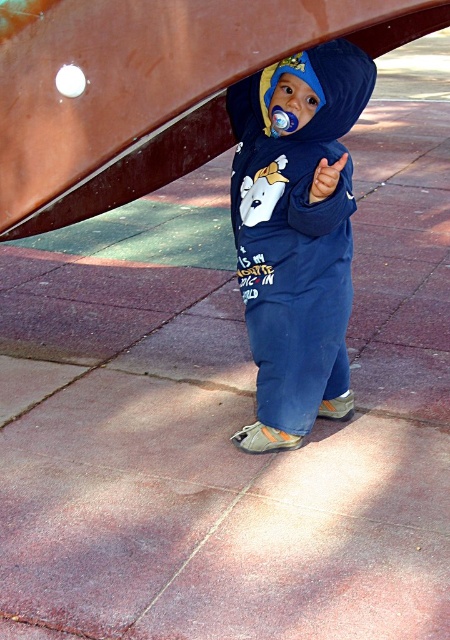
You are a photographer setting up a shot of the child in the scene. You need to ensure that the navy blue fleece onesie at center and the rubber teething ring at center are both clearly visible in the frame. Based on their sizes, which object should you focus on to ensure both are in focus?

The navy blue fleece onesie at center is wider than the rubber teething ring at center, so focusing on the navy blue fleece onesie at center will ensure both are in focus since it is larger and occupies more space in the frame.

You are taking a photo of the two points in the image. Which point, point (341, 333) or point (313, 189), is closer to the camera?

Point (313, 189) is closer to the camera than point (341, 333).

You are a photographer trying to capture the child in the image. You notice the navy blue fleece onesie at center and the rubber teething ring at center. Which object should you focus on first to ensure the child is in sharp focus?

The navy blue fleece onesie at center is closer to the viewer than the rubber teething ring at center, so focusing on the navy blue fleece onesie at center will ensure the child is in sharp focus.